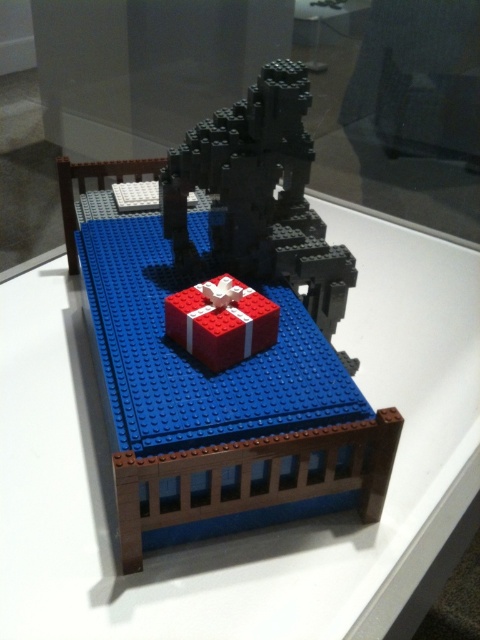
Question: Is the position of transparent glass bed at center more distant than that of smooth red gift box at center?

Choices:
 (A) yes
 (B) no

Answer: (B)

Question: Does transparent glass bed at center have a smaller size compared to smooth red gift box at center?

Choices:
 (A) no
 (B) yes

Answer: (A)

Question: Which of the following is the closest to the observer?

Choices:
 (A) smooth red gift box at center
 (B) transparent glass bed at center

Answer: (B)

Question: Can you confirm if transparent glass bed at center is positioned to the right of smooth red gift box at center?

Choices:
 (A) no
 (B) yes

Answer: (B)